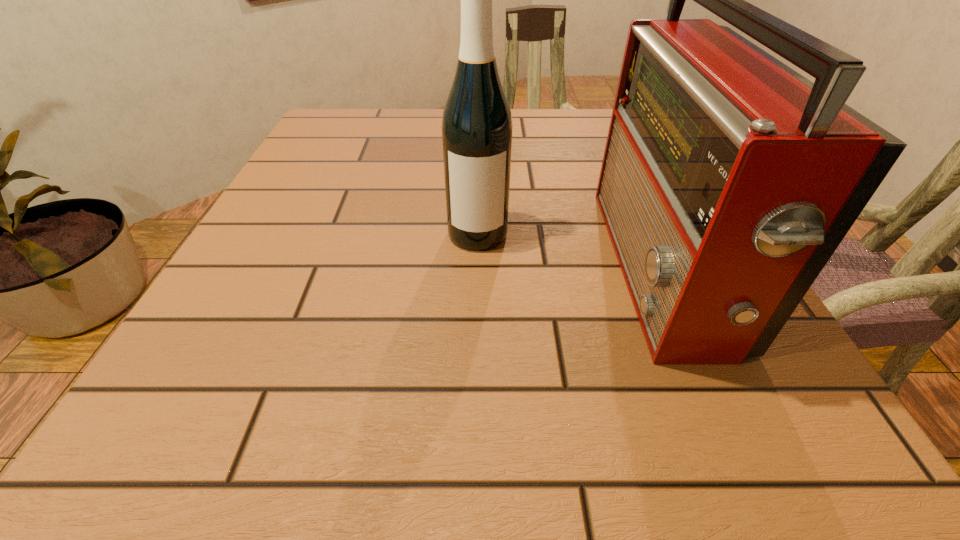
What are the coordinates of `the left object` in the screenshot? It's located at (477, 128).

Find the location of `the right object`. the right object is located at coordinates (728, 180).

At what (x,y) coordinates should I click in order to perform the action: click on free location located on the label of the left object. Please return your answer as a coordinate pair (x, y). This screenshot has height=540, width=960. Looking at the image, I should click on (477, 345).

The width and height of the screenshot is (960, 540). Identify the location of vacant space located on the front-facing side of the right object. (397, 268).

Image resolution: width=960 pixels, height=540 pixels. I want to click on vacant space located on the front-facing side of the right object, so click(360, 268).

Where is `vacant space located 0.120m on the front-facing side of the right object`? The width and height of the screenshot is (960, 540). vacant space located 0.120m on the front-facing side of the right object is located at coordinates (537, 268).

Image resolution: width=960 pixels, height=540 pixels. Identify the location of object present at the right edge. (728, 180).

Find the location of a particular element. This screenshot has height=540, width=960. vacant space at the far edge of the desktop is located at coordinates (405, 152).

This screenshot has height=540, width=960. I want to click on blank space at the near edge, so click(447, 462).

Image resolution: width=960 pixels, height=540 pixels. In the image, there is a desktop. In order to click on vacant area at the left edge in this screenshot , I will do `click(281, 222)`.